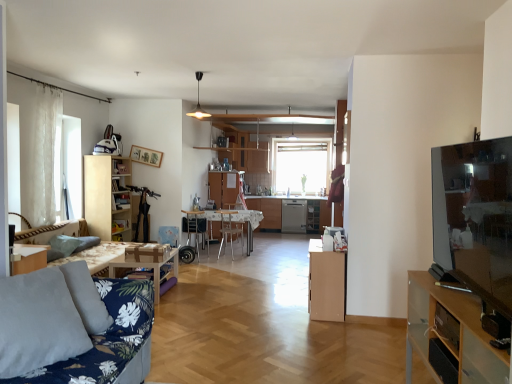
I want to click on free space in front of metallic silver chair at center, which is the 2th chair from left to right, so click(227, 263).